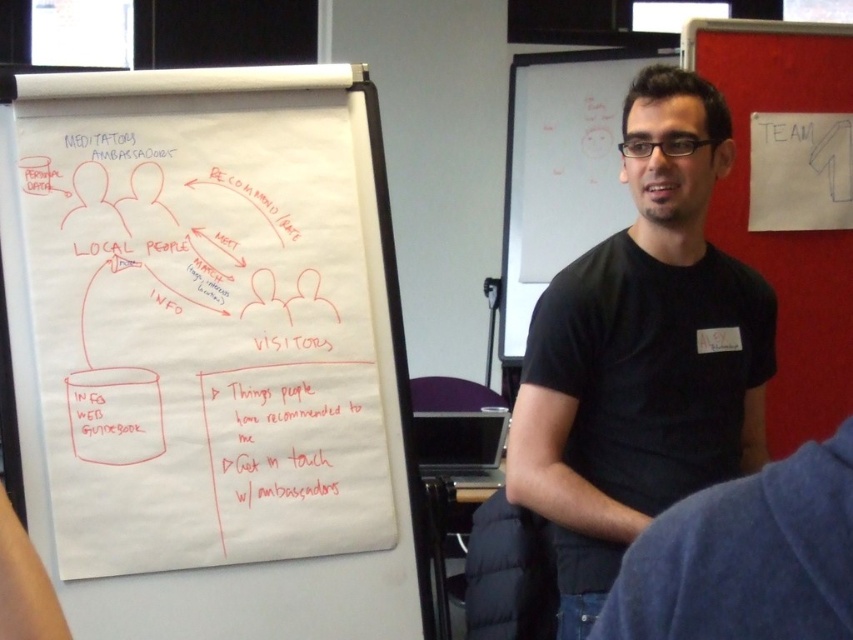
Question: Which point is farther from the camera taking this photo?

Choices:
 (A) (724, 214)
 (B) (764, 305)
 (C) (328, 620)

Answer: (A)

Question: Does white paper at left have a larger size compared to red fabric bulletin board at upper right?

Choices:
 (A) yes
 (B) no

Answer: (A)

Question: Is black matte t-shirt at center to the left of red fabric bulletin board at upper right from the viewer's perspective?

Choices:
 (A) yes
 (B) no

Answer: (A)

Question: Which object appears farthest from the camera in this image?

Choices:
 (A) white paper at left
 (B) black matte t-shirt at center

Answer: (A)

Question: Which object is the farthest from the white paper at left?

Choices:
 (A) black matte t-shirt at center
 (B) red fabric bulletin board at upper right

Answer: (B)

Question: Where is black matte t-shirt at center located in relation to red fabric bulletin board at upper right in the image?

Choices:
 (A) left
 (B) right

Answer: (A)